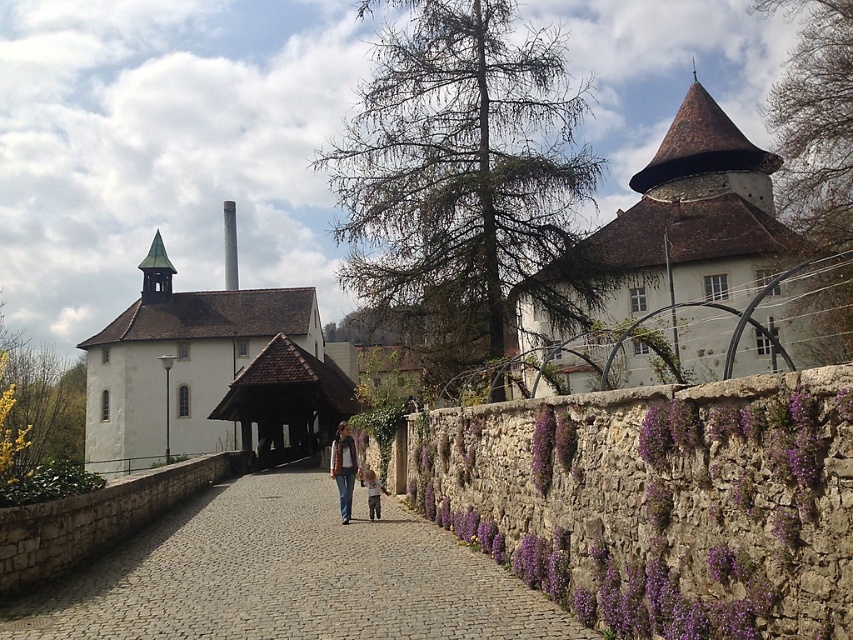
Which is in front, point (125, 317) or point (234, 205)?

Positioned in front is point (125, 317).

Where is `white matte church at left`? white matte church at left is located at coordinates (180, 364).

Is point (206, 416) closer to camera compared to point (231, 259)?

Yes, it is in front of point (231, 259).

Image resolution: width=853 pixels, height=640 pixels. Find the location of `white matte church at left`. white matte church at left is located at coordinates [180, 364].

Is denim jacket at center smaller than smooth white spire at upper center?

Yes, denim jacket at center is smaller than smooth white spire at upper center.

Who is positioned more to the right, denim jacket at center or smooth white spire at upper center?

Positioned to the right is denim jacket at center.

Find the location of a particular element. This screenshot has height=640, width=853. denim jacket at center is located at coordinates (346, 468).

Who is shorter, white matte church at left or denim jacket at center?

Standing shorter between the two is denim jacket at center.

Which is more to the right, white matte church at left or denim jacket at center?

denim jacket at center

Locate an element on the screen. Image resolution: width=853 pixels, height=640 pixels. white matte church at left is located at coordinates (180, 364).